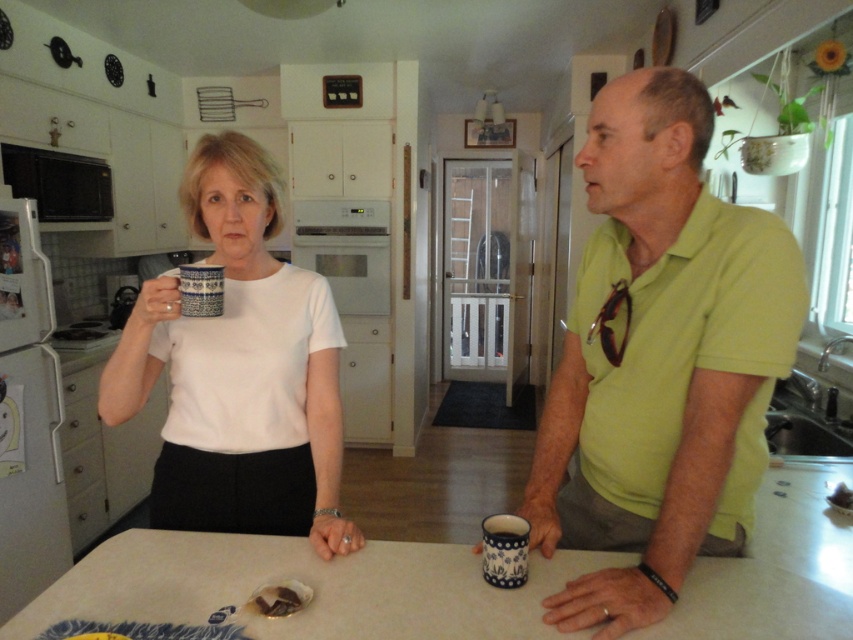
Measure the distance between blue ceramic mug at left and camera.

blue ceramic mug at left is 1.16 meters away from camera.

Does blue ceramic mug at left appear on the left side of blue ceramic mug at upper center?

In fact, blue ceramic mug at left is to the right of blue ceramic mug at upper center.

In order to click on blue ceramic mug at left in this screenshot , I will do `click(239, 371)`.

I want to click on blue ceramic mug at left, so click(239, 371).

Does green matte shirt at right have a larger size compared to blue ceramic mug at left?

Yes, green matte shirt at right is bigger than blue ceramic mug at left.

Does point (730, 330) come in front of point (316, 534)?

Yes, it is.

This screenshot has width=853, height=640. Identify the location of green matte shirt at right. (659, 358).

Can you confirm if blue ceramic mug at left is positioned to the left of white laminate table at center?

Indeed, blue ceramic mug at left is positioned on the left side of white laminate table at center.

Who is lower down, blue ceramic mug at left or white laminate table at center?

Positioned lower is white laminate table at center.

Which is behind, point (305, 476) or point (816, 600)?

The point (305, 476) is more distant.

Image resolution: width=853 pixels, height=640 pixels. Find the location of `blue ceramic mug at left`. blue ceramic mug at left is located at coordinates (239, 371).